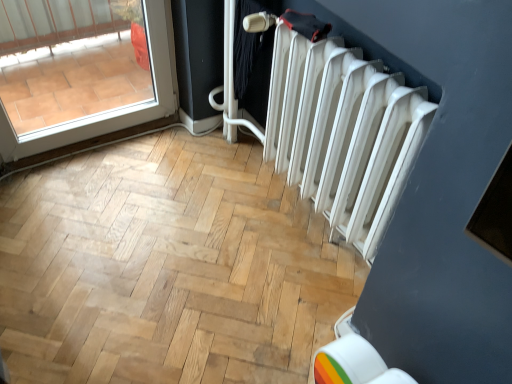
Identify the location of vacant area that is in front of transparent glass door at upper left. click(74, 182).